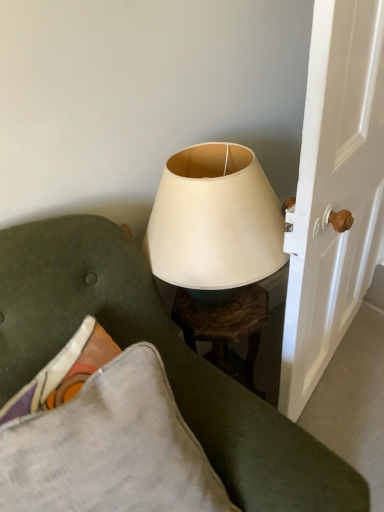
Question: From the image's perspective, is matte white lampshade at upper center beneath white glossy door handle at right?

Choices:
 (A) yes
 (B) no

Answer: (A)

Question: Is matte white lampshade at upper center not inside white glossy door handle at right?

Choices:
 (A) no
 (B) yes

Answer: (B)

Question: Does matte white lampshade at upper center appear on the right side of white glossy door handle at right?

Choices:
 (A) no
 (B) yes

Answer: (A)

Question: Considering the relative sizes of matte white lampshade at upper center and white glossy door handle at right in the image provided, is matte white lampshade at upper center bigger than white glossy door handle at right?

Choices:
 (A) no
 (B) yes

Answer: (A)

Question: Would you say white glossy door handle at right is part of matte white lampshade at upper center's contents?

Choices:
 (A) yes
 (B) no

Answer: (B)

Question: In terms of height, does white glossy door handle at right look taller or shorter compared to matte white lampshade at center?

Choices:
 (A) tall
 (B) short

Answer: (A)

Question: Is white glossy door handle at right inside or outside of matte white lampshade at center?

Choices:
 (A) outside
 (B) inside

Answer: (A)

Question: In the image, is white glossy door handle at right positioned in front of or behind matte white lampshade at center?

Choices:
 (A) behind
 (B) front

Answer: (B)

Question: Considering the positions of white glossy door handle at right and matte white lampshade at center in the image, is white glossy door handle at right bigger or smaller than matte white lampshade at center?

Choices:
 (A) small
 (B) big

Answer: (B)

Question: Considering the positions of matte white lampshade at center and white glossy door handle at right in the image, is matte white lampshade at center wider or thinner than white glossy door handle at right?

Choices:
 (A) wide
 (B) thin

Answer: (A)

Question: Is matte white lampshade at center inside or outside of white glossy door handle at right?

Choices:
 (A) outside
 (B) inside

Answer: (A)

Question: Considering their positions, is matte white lampshade at center located in front of or behind white glossy door handle at right?

Choices:
 (A) front
 (B) behind

Answer: (B)

Question: Is matte white lampshade at center taller or shorter than white glossy door handle at right?

Choices:
 (A) tall
 (B) short

Answer: (B)

Question: From a real-world perspective, is white glossy door handle at right above or below matte white lampshade at upper center?

Choices:
 (A) below
 (B) above

Answer: (B)

Question: Is point (354, 215) closer or farther from the camera than point (261, 433)?

Choices:
 (A) farther
 (B) closer

Answer: (A)